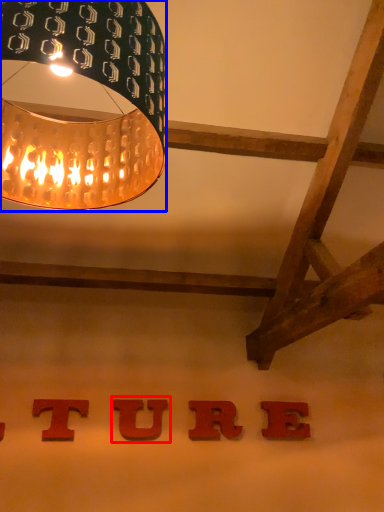
Question: Which object is closer to the camera taking this photo, alphabet (highlighted by a red box) or lamp (highlighted by a blue box)?

Choices:
 (A) alphabet
 (B) lamp

Answer: (B)